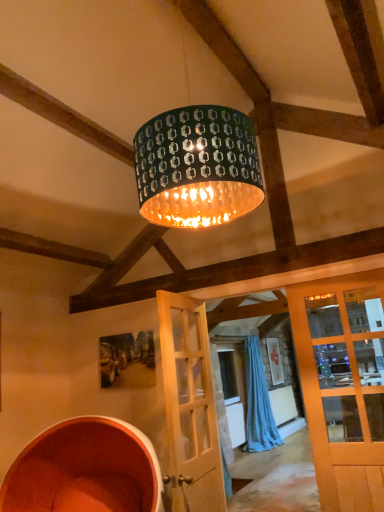
This screenshot has width=384, height=512. What do you see at coordinates (258, 402) in the screenshot? I see `blue fabric curtain at center` at bounding box center [258, 402].

This screenshot has width=384, height=512. Find the location of `blue fabric curtain at center`. blue fabric curtain at center is located at coordinates (258, 402).

Considering the relative sizes of light wood door at center and green metallic drum at center in the image provided, is light wood door at center shorter than green metallic drum at center?

Incorrect, the height of light wood door at center does not fall short of that of green metallic drum at center.

Is light wood door at center located outside green metallic drum at center?

Absolutely, light wood door at center is external to green metallic drum at center.

From the image's perspective, between light wood door at center and green metallic drum at center, who is located below?

light wood door at center.

How different are the orientations of light wood door at center and green metallic drum at center in degrees?

2.82 degrees separate the facing orientations of light wood door at center and green metallic drum at center.

Looking at this image, is green metallic drum at center wider than blue fabric curtain at center?

Yes, green metallic drum at center is wider than blue fabric curtain at center.

Based on the photo, is green metallic drum at center situated inside blue fabric curtain at center or outside?

green metallic drum at center cannot be found inside blue fabric curtain at center.

From the picture: How different are the orientations of green metallic drum at center and blue fabric curtain at center in degrees?

2.02 degrees.

Which is behind, green metallic drum at center or blue fabric curtain at center?

blue fabric curtain at center is further from the camera.

From the image's perspective, between light wood door at center and blue fabric curtain at center, who is located below?

blue fabric curtain at center.

Does light wood door at center lie in front of blue fabric curtain at center?

Yes, light wood door at center is in front of blue fabric curtain at center.

Does light wood door at center have a lesser width compared to blue fabric curtain at center?

Yes, light wood door at center is thinner than blue fabric curtain at center.

From a real-world perspective, is light wood door at center physically located above or below blue fabric curtain at center?

In terms of real-world spatial position, light wood door at center is above blue fabric curtain at center.

Is blue fabric curtain at center taller or shorter than green metallic drum at center?

In the image, blue fabric curtain at center appears to be taller than green metallic drum at center.

Considering the points (271, 420) and (209, 112), which point is behind, point (271, 420) or point (209, 112)?

The point (271, 420) is farther.

Is blue fabric curtain at center at the right side of green metallic drum at center?

Yes, blue fabric curtain at center is to the right of green metallic drum at center.

Can you tell me how much blue fabric curtain at center and green metallic drum at center differ in facing direction?

There is a 2.02-degree angle between the facing directions of blue fabric curtain at center and green metallic drum at center.

Is blue fabric curtain at center situated inside light wood door at center or outside?

blue fabric curtain at center lies outside light wood door at center.

Which object is positioned more to the left, blue fabric curtain at center or light wood door at center?

From the viewer's perspective, light wood door at center appears more on the left side.

From the image's perspective, who appears lower, blue fabric curtain at center or light wood door at center?

From the image's view, blue fabric curtain at center is below.

Is green metallic drum at center positioned beyond the bounds of light wood door at center?

That's correct, green metallic drum at center is outside of light wood door at center.

From the image's perspective, which one is positioned lower, green metallic drum at center or light wood door at center?

From the image's view, light wood door at center is below.

Does green metallic drum at center turn towards light wood door at center?

No, green metallic drum at center does not turn towards light wood door at center.

Between green metallic drum at center and light wood door at center, which one appears on the left side from the viewer's perspective?

green metallic drum at center is more to the left.

Where is `lamp on the left of light wood door at center`? The height and width of the screenshot is (512, 384). lamp on the left of light wood door at center is located at coordinates (197, 167).

Locate an element on the screen. The height and width of the screenshot is (512, 384). curtain that is below the green metallic drum at center (from the image's perspective) is located at coordinates (258, 402).

When comparing their distances from light wood door at center, does green metallic drum at center or blue fabric curtain at center seem closer?

green metallic drum at center is positioned closer to the anchor light wood door at center.

When comparing their distances from light wood door at center, does blue fabric curtain at center or green metallic drum at center seem further?

blue fabric curtain at center is further to light wood door at center.

Consider the image. When comparing their distances from blue fabric curtain at center, does green metallic drum at center or light wood door at center seem closer?

The object closer to blue fabric curtain at center is light wood door at center.

Looking at the image, which one is located closer to blue fabric curtain at center, light wood door at center or green metallic drum at center?

light wood door at center is positioned closer to the anchor blue fabric curtain at center.

Looking at the image, which one is located further to green metallic drum at center, blue fabric curtain at center or light wood door at center?

blue fabric curtain at center is positioned further to the anchor green metallic drum at center.

From the picture: Which object lies further to the anchor point green metallic drum at center, light wood door at center or blue fabric curtain at center?

Based on the image, blue fabric curtain at center appears to be further to green metallic drum at center.

Find the location of a particular element. The width and height of the screenshot is (384, 512). door positioned between green metallic drum at center and blue fabric curtain at center from near to far is located at coordinates (190, 406).